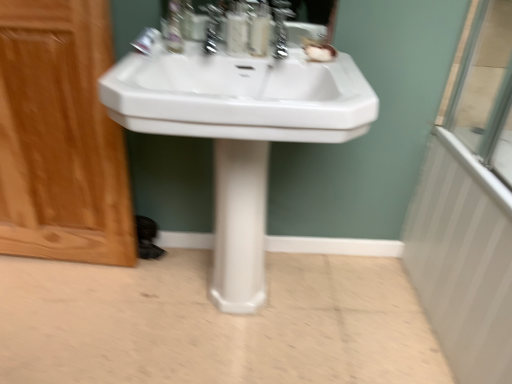
Locate an element on the screen. The height and width of the screenshot is (384, 512). empty space that is to the right of wooden screen door at left is located at coordinates (147, 292).